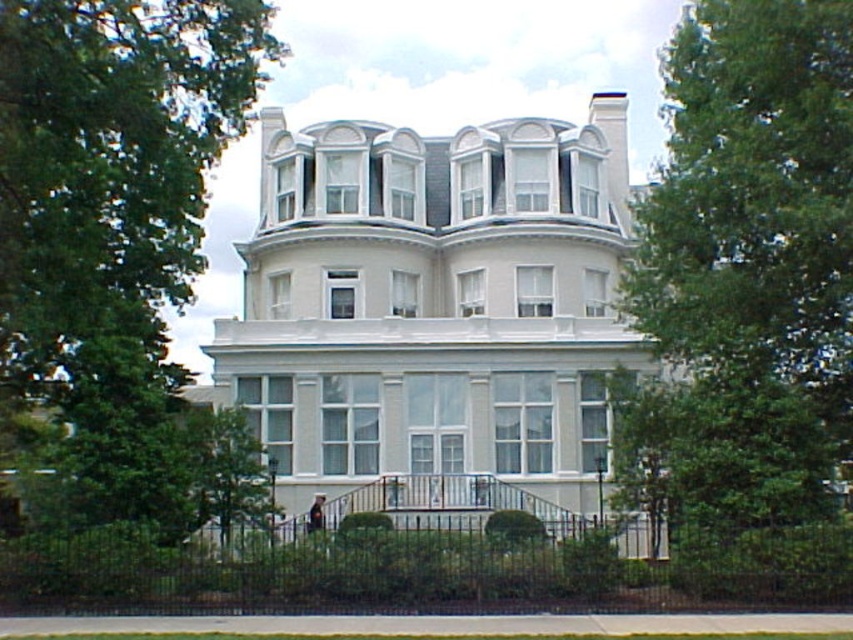
You are standing in front of the house and want to take a photo that includes both the white smooth mansion at center and the green leafy tree at lower center. Which object should you place closer to the left side of your camera frame?

The green leafy tree at lower center should be placed closer to the left side of your camera frame because the white smooth mansion at center is positioned on the right side of it.

Based on the photo, you are a landscape architect planning to install a new walkway between the two green leafy trees mentioned. The walkway must be exactly 15 meters long. Based on the distance between the green leafy tree at center and the green leafy tree at lower center, will the walkway fit without needing adjustments?

The distance between the green leafy tree at center and the green leafy tree at lower center is 13.36 meters. Since the walkway is 15 meters long, it is longer than the space available. Therefore, the walkway will not fit without adjustments.